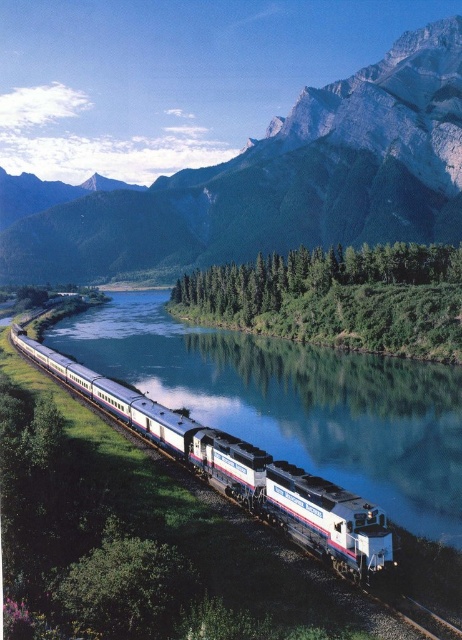
Is rugged granite mountain at upper center to the left of metal train track at lower right from the viewer's perspective?

Indeed, rugged granite mountain at upper center is positioned on the left side of metal train track at lower right.

Is point (233, 234) behind point (455, 628)?

Yes, it is behind point (455, 628).

Is point (85, 243) behind point (399, 595)?

Yes, it is behind point (399, 595).

Find the location of a particular element. rugged granite mountain at upper center is located at coordinates (280, 180).

How distant is white glossy train at center from metal train track at lower right?

They are 44.65 feet apart.

Is white glossy train at center smaller than metal train track at lower right?

Actually, white glossy train at center might be larger than metal train track at lower right.

Does point (304, 538) come closer to viewer compared to point (421, 625)?

No, (304, 538) is further to viewer.

Where is `white glossy train at center`? white glossy train at center is located at coordinates (241, 470).

Does rugged granite mountain at upper center lie behind green leafy trees at center?

Yes, rugged granite mountain at upper center is further from the viewer.

Find the location of a particular element. This screenshot has height=640, width=462. rugged granite mountain at upper center is located at coordinates (280, 180).

I want to click on rugged granite mountain at upper center, so click(280, 180).

Image resolution: width=462 pixels, height=640 pixels. In order to click on rugged granite mountain at upper center in this screenshot , I will do `click(280, 180)`.